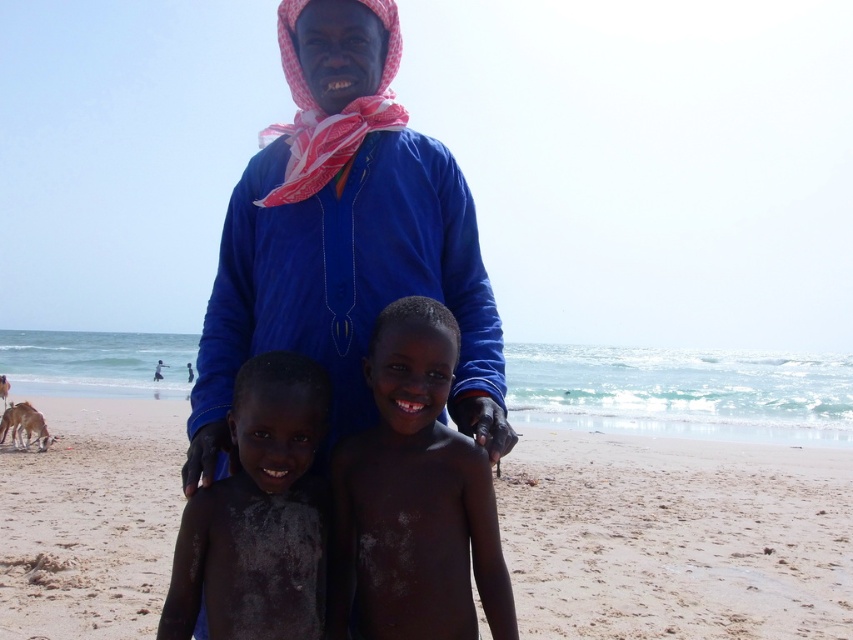
Question: Is sandy beach at center below dark skin/rough skin child at center?

Choices:
 (A) yes
 (B) no

Answer: (A)

Question: Which of the following is the closest to the observer?

Choices:
 (A) (503, 602)
 (B) (201, 408)

Answer: (A)

Question: Which object is farther from the camera taking this photo?

Choices:
 (A) smooth skin boy at center
 (B) blue cotton shirt at center
 (C) dark skin/rough skin child at center

Answer: (B)

Question: Which object is farther from the camera taking this photo?

Choices:
 (A) smooth skin boy at center
 (B) blue cotton shirt at center
 (C) dark skin/rough skin child at center
 (D) sandy beach at center

Answer: (D)

Question: Is blue cotton shirt at center thinner than smooth skin boy at center?

Choices:
 (A) yes
 (B) no

Answer: (B)

Question: Is sandy beach at center behind blue cotton shirt at center?

Choices:
 (A) yes
 (B) no

Answer: (A)